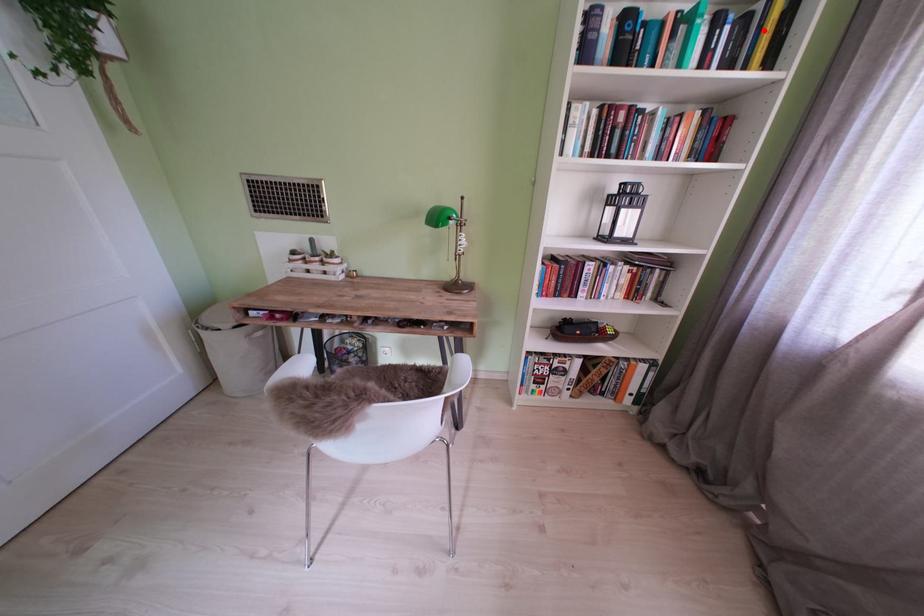
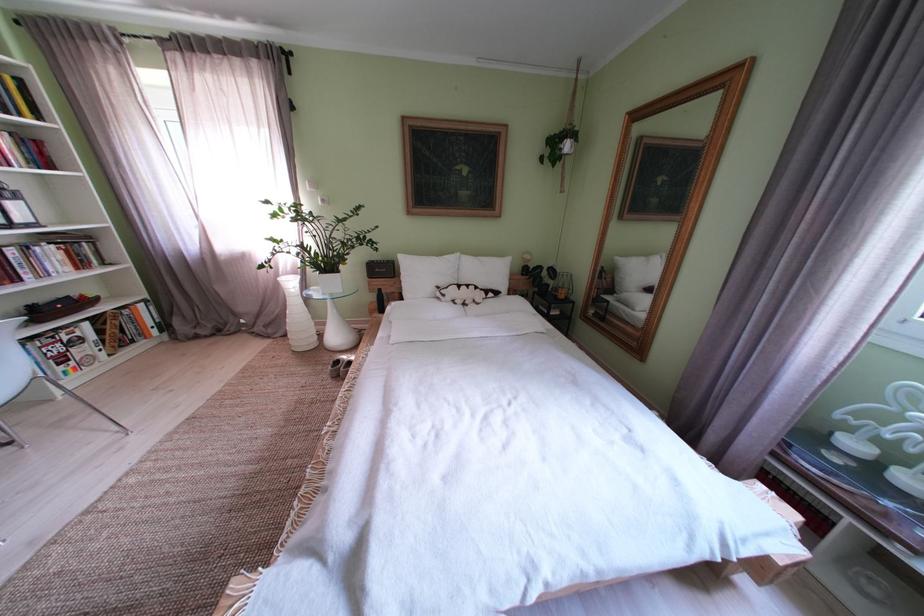
Question: I am providing you with two images of the same scene from different viewpoints. A red point is marked on the first image. At the location where the point appears in image 1, is it still visible in image 2?

Choices:
 (A) Yes
 (B) No

Answer: (A)